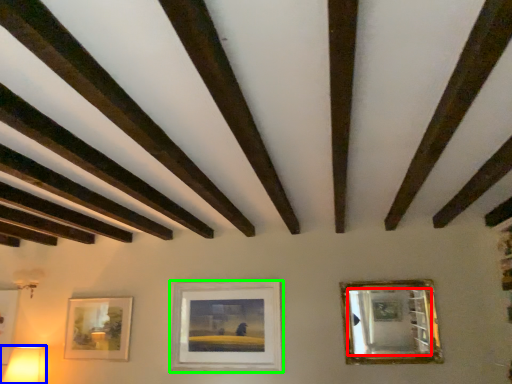
Question: Estimate the real-world distances between objects in this image. Which object is closer to mirror (highlighted by a red box), table lamp (highlighted by a blue box) or picture frame (highlighted by a green box)?

Choices:
 (A) table lamp
 (B) picture frame

Answer: (B)